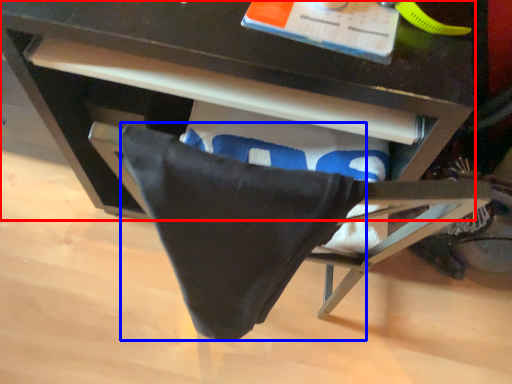
Question: Which object is further to the camera taking this photo, desk (highlighted by a red box) or blanket (highlighted by a blue box)?

Choices:
 (A) desk
 (B) blanket

Answer: (A)